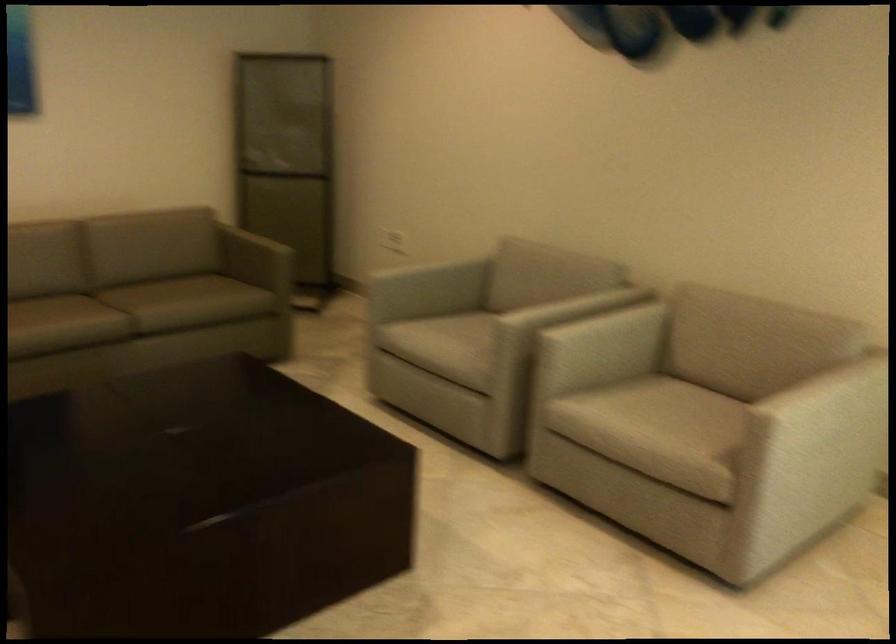
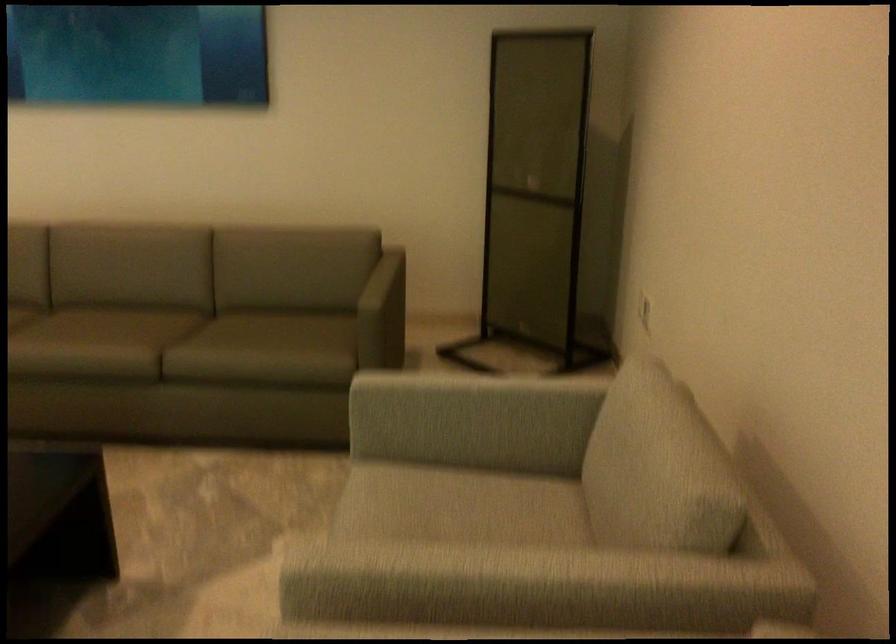
Locate, in the second image, the point that corresponds to [421,269] in the first image.

(469, 399)